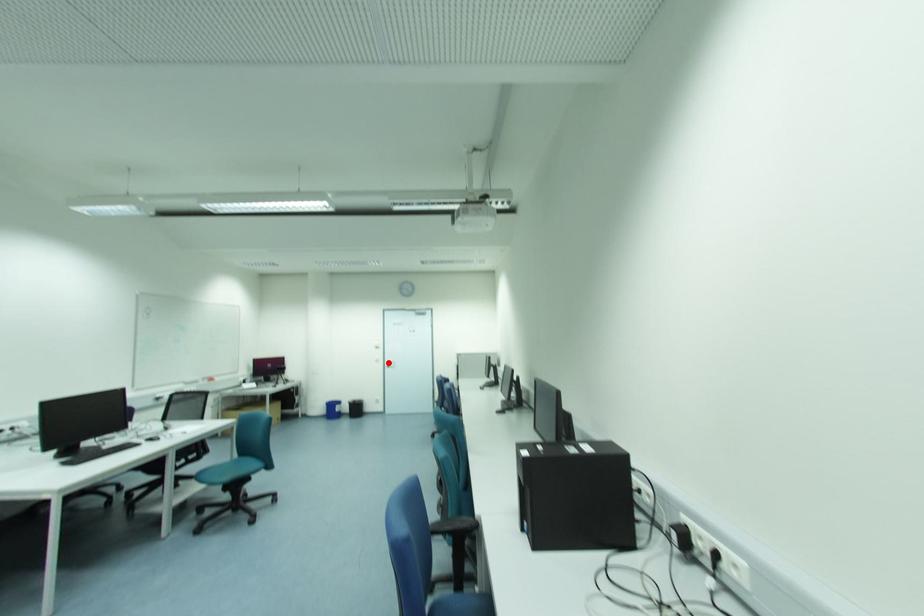
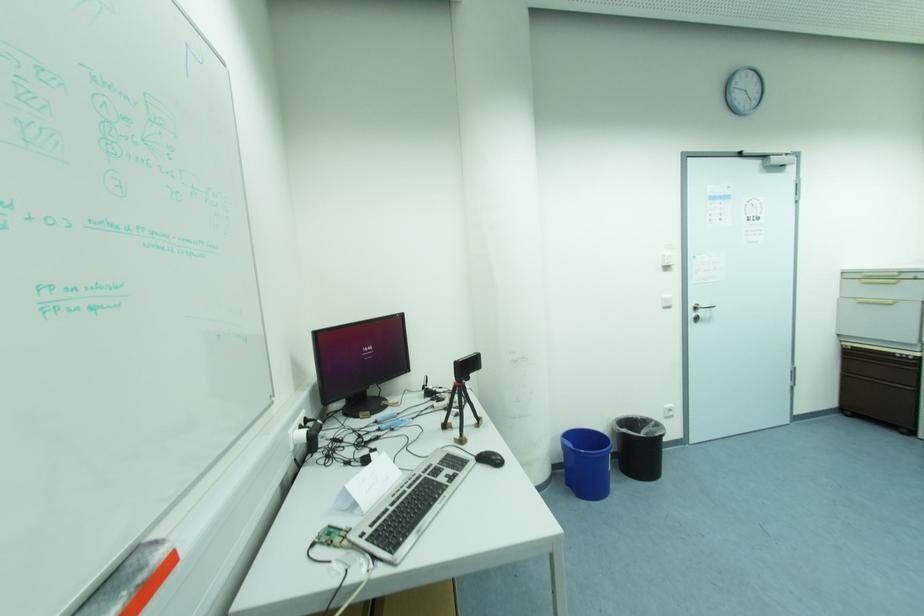
Where in the second image is the point corresponding to the highlighted location from the first image?

(697, 309)